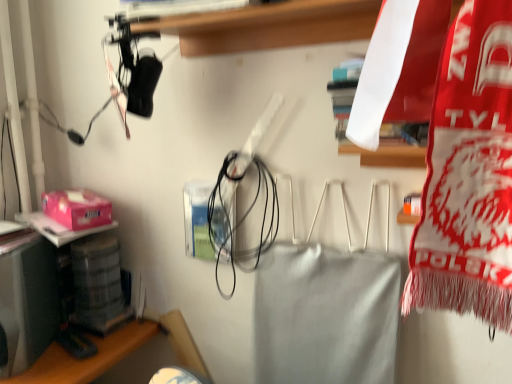
Locate an element on the screen. This screenshot has height=384, width=512. pink matte tissue box at left is located at coordinates (77, 209).

What do you see at coordinates (77, 209) in the screenshot?
I see `pink matte tissue box at left` at bounding box center [77, 209].

I want to click on pink matte tissue box at left, so click(x=77, y=209).